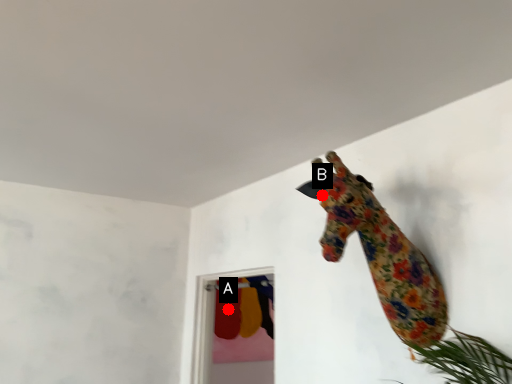
Question: Two points are circled on the image, labeled by A and B beside each circle. Which point is further to the camera?

Choices:
 (A) A is further
 (B) B is further

Answer: (A)